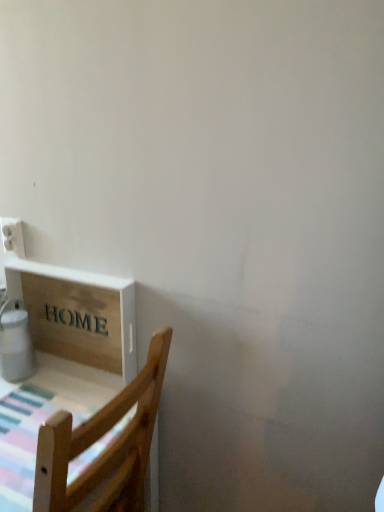
You are a GUI agent. You are given a task and a screenshot of the screen. Output one action in this format:
    pyautogui.click(x=<x>, y=<y>)
    Task: Click on the vacant point to the right of white glossy water heater at lower left
    This screenshot has height=512, width=384.
    Given the screenshot: What is the action you would take?
    pyautogui.click(x=55, y=385)